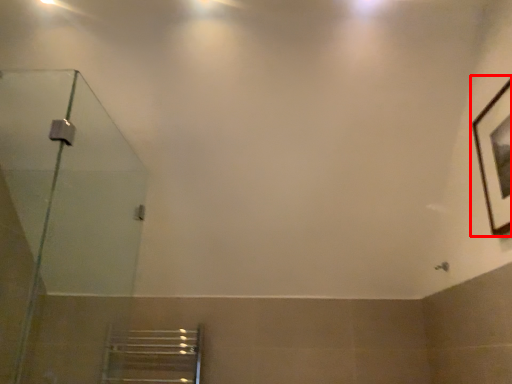
Question: From the image's perspective, what is the correct spatial positioning of picture frame (annotated by the red box) in reference to shower door?

Choices:
 (A) above
 (B) below

Answer: (A)